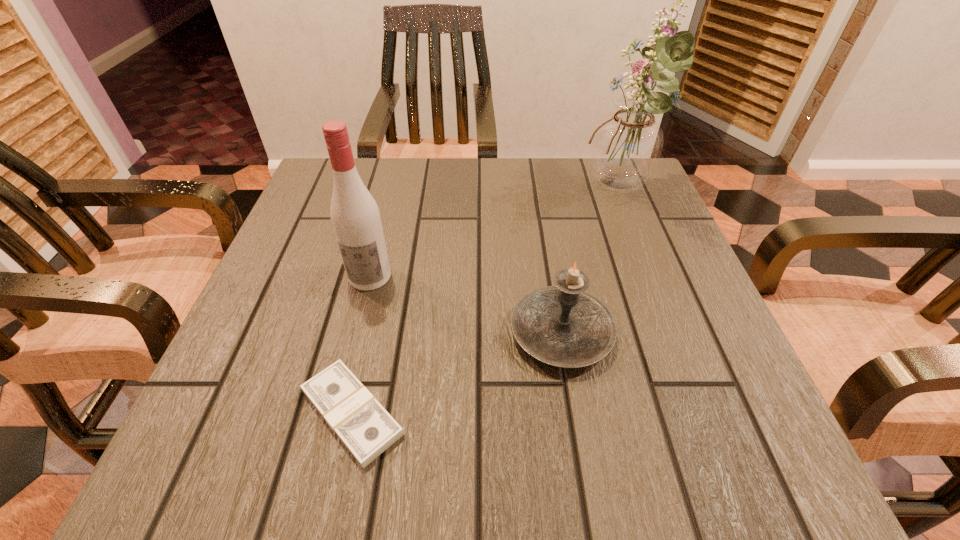
Where is `vacant area between the dollar and the farthest object`? This screenshot has height=540, width=960. vacant area between the dollar and the farthest object is located at coordinates (486, 302).

The image size is (960, 540). What are the coordinates of `free space between the dollar and the second farthest object` in the screenshot? It's located at point(361,345).

Identify the location of free space between the shortest object and the bouquet. The height and width of the screenshot is (540, 960). click(x=486, y=302).

You are a GUI agent. You are given a task and a screenshot of the screen. Output one action in this format:
    pyautogui.click(x=<x>, y=<y>)
    Task: Click on the free space between the third object from left to right and the bouquet
    
    Given the screenshot: What is the action you would take?
    coord(590,262)

Image resolution: width=960 pixels, height=540 pixels. Identify the location of vacant space that's between the second object from right to left and the alcohol. (466, 305).

Identify the location of unoccupied position between the third object from left to right and the farthest object. The width and height of the screenshot is (960, 540). (590, 262).

I want to click on vacant space in between the bouquet and the alcohol, so click(494, 234).

I want to click on object that stands as the second closest to the shortest object, so click(356, 220).

Identify which object is located as the third nearest to the shortest object. Please provide its 2D coordinates. Your answer should be formatted as a tuple, i.e. [(x, y)], where the tuple contains the x and y coordinates of a point satisfying the conditions above.

[(626, 146)]

You are a GUI agent. You are given a task and a screenshot of the screen. Output one action in this format:
    pyautogui.click(x=<x>, y=<y>)
    Task: Click on the vacant point that satisfies the following two spatial constraints: 1. on the back side of the candle; 2. on the right side of the shortest object
    Image resolution: width=960 pixels, height=540 pixels.
    Given the screenshot: What is the action you would take?
    pyautogui.click(x=370, y=333)